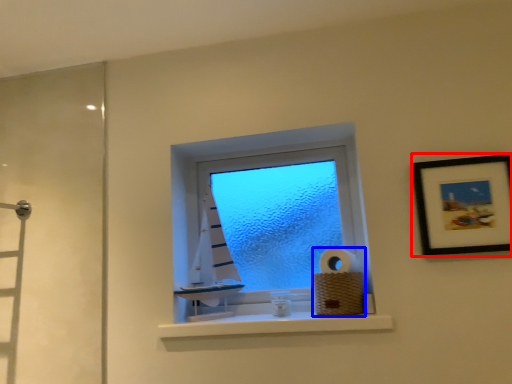
Question: Which object is further to the camera taking this photo, picture frame (highlighted by a red box) or toilet paper (highlighted by a blue box)?

Choices:
 (A) picture frame
 (B) toilet paper

Answer: (B)